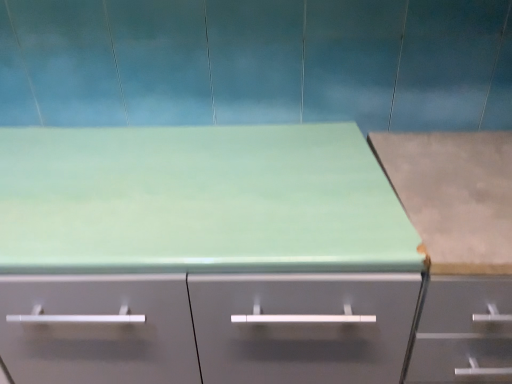
Describe the element at coordinates (229, 263) in the screenshot. I see `matte green countertop at center` at that location.

The height and width of the screenshot is (384, 512). Identify the location of matte green countertop at center. (229, 263).

The height and width of the screenshot is (384, 512). Identify the location of matte green countertop at center. (229, 263).